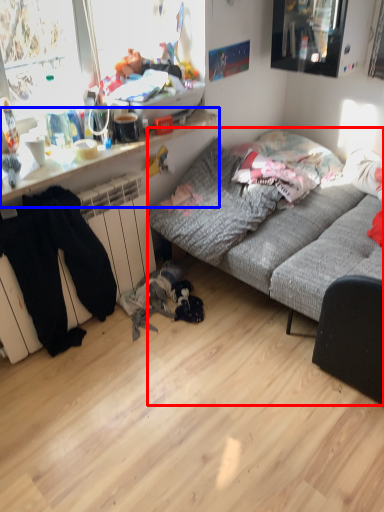
Question: Among these objects, which one is farthest to the camera, studio couch (highlighted by a red box) or desk (highlighted by a blue box)?

Choices:
 (A) studio couch
 (B) desk

Answer: (B)